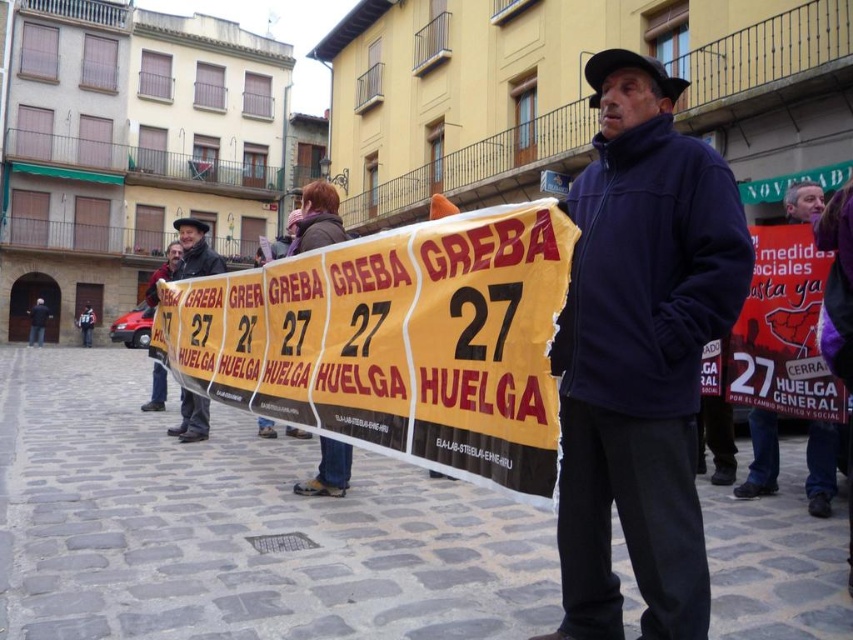
Question: Can you confirm if navy blue fleece jacket at center is thinner than matte black jacket at left?

Choices:
 (A) yes
 (B) no

Answer: (A)

Question: Based on their relative distances, which object is farther from the matte black jacket at center?

Choices:
 (A) matte black jacket at left
 (B) yellow paper banner at center
 (C) navy blue fleece jacket at center

Answer: (A)

Question: Can you confirm if navy blue fleece jacket at center is positioned to the left of matte black jacket at center?

Choices:
 (A) no
 (B) yes

Answer: (B)

Question: Which object appears farthest from the camera in this image?

Choices:
 (A) matte black jacket at center
 (B) navy blue fleece jacket at center
 (C) yellow paper banner at center

Answer: (A)

Question: Which of the following is the closest to the observer?

Choices:
 (A) matte black jacket at center
 (B) matte black jacket at left
 (C) navy blue fleece jacket at center

Answer: (C)

Question: In this image, where is yellow paper banner at center located relative to matte black jacket at left?

Choices:
 (A) below
 (B) above

Answer: (A)